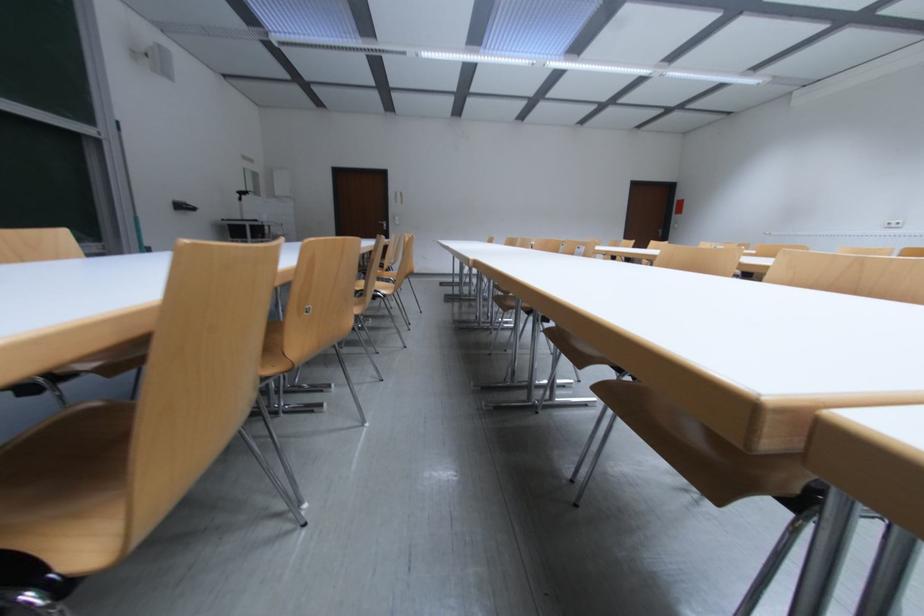
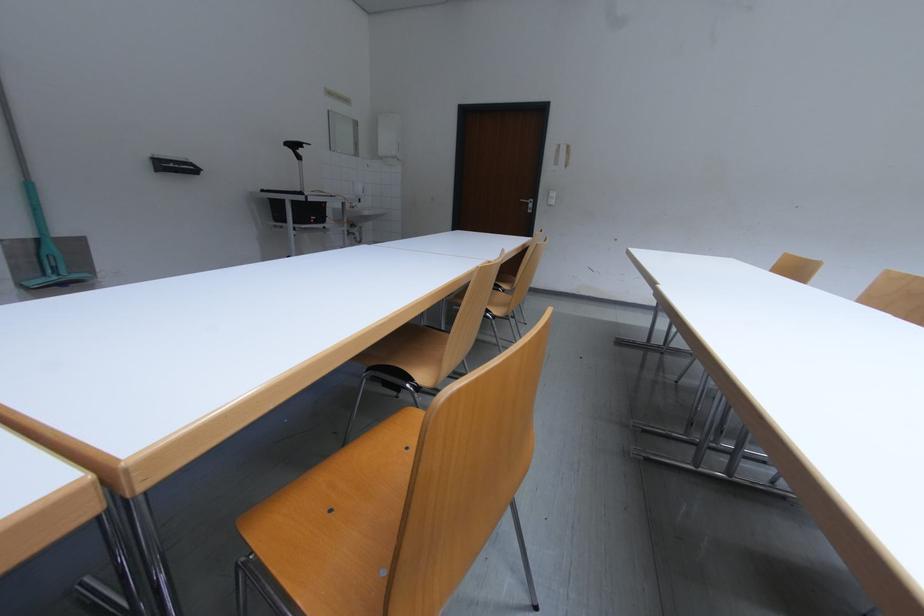
The point at (252, 195) is marked in the first image. Where is the corresponding point in the second image?

(302, 147)